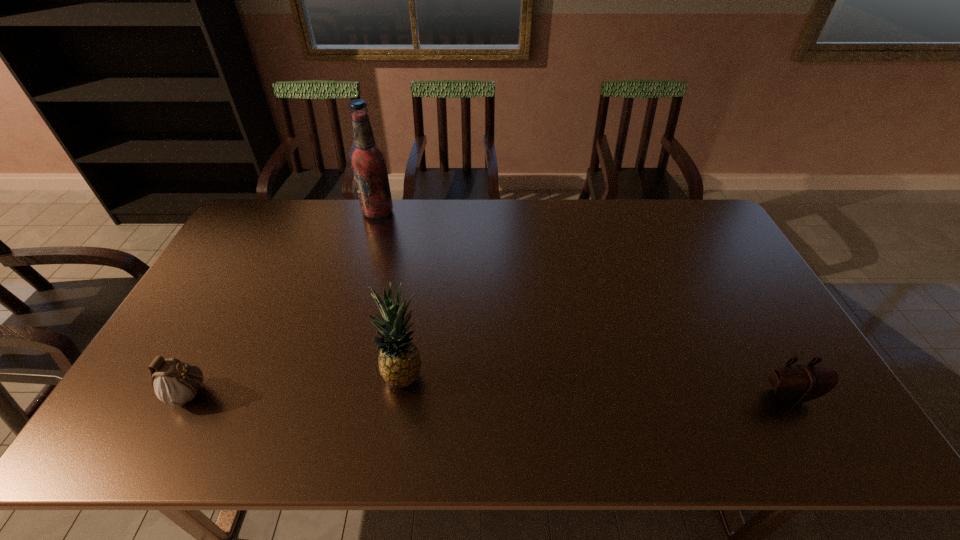
Locate an element on the screen. This screenshot has height=540, width=960. alcohol is located at coordinates (368, 162).

This screenshot has height=540, width=960. I want to click on the tallest object, so click(x=368, y=162).

At what (x,y) coordinates should I click in order to perform the action: click on the third shortest object. Please return your answer as a coordinate pair (x, y). This screenshot has height=540, width=960. Looking at the image, I should click on (399, 362).

Find the location of `pineapple`. pineapple is located at coordinates (399, 362).

Identify the location of the left pouch. The image size is (960, 540). (175, 383).

I want to click on the right pouch, so click(x=796, y=384).

The image size is (960, 540). What are the coordinates of `free space located 0.260m on the front of the alcohol` in the screenshot? It's located at (362, 271).

I want to click on vacant space located on the back of the pineapple, so click(x=411, y=324).

Identify the location of free space located on the front-facing side of the leftmost object. This screenshot has height=540, width=960. (242, 394).

The width and height of the screenshot is (960, 540). In order to click on blank space located 0.070m with the flap open on the right pouch in this screenshot , I will do click(x=812, y=436).